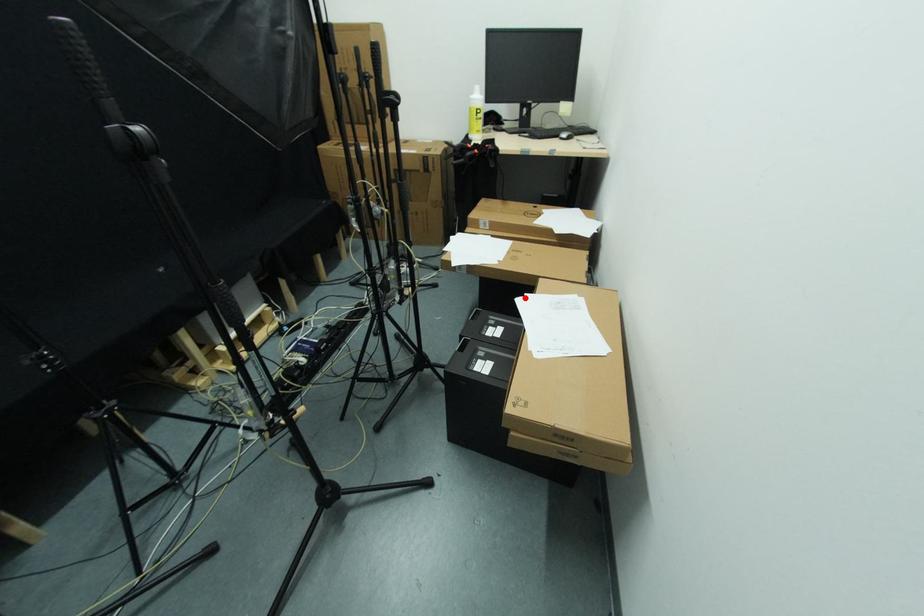
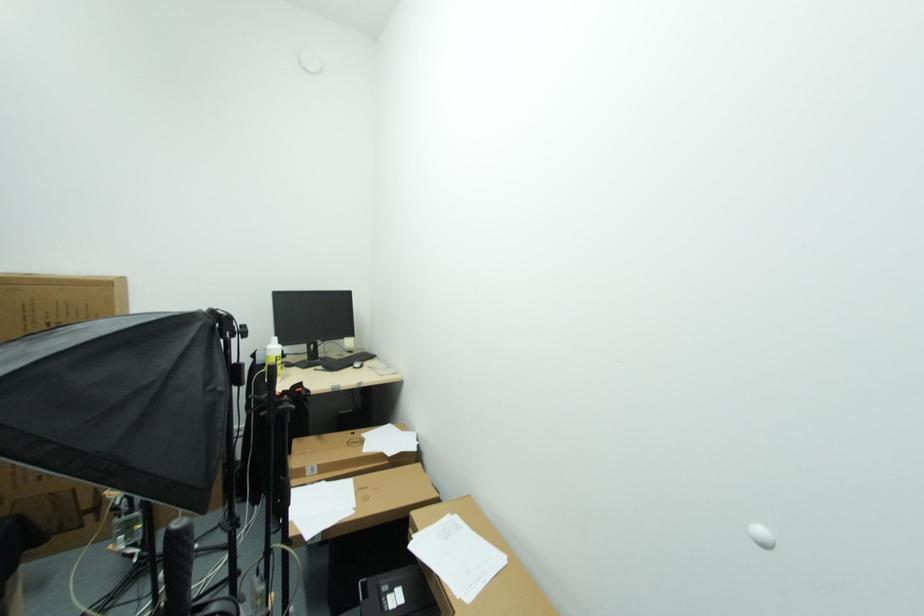
Where in the second image is the point corresponding to the highlighted location from the first image?

(414, 541)